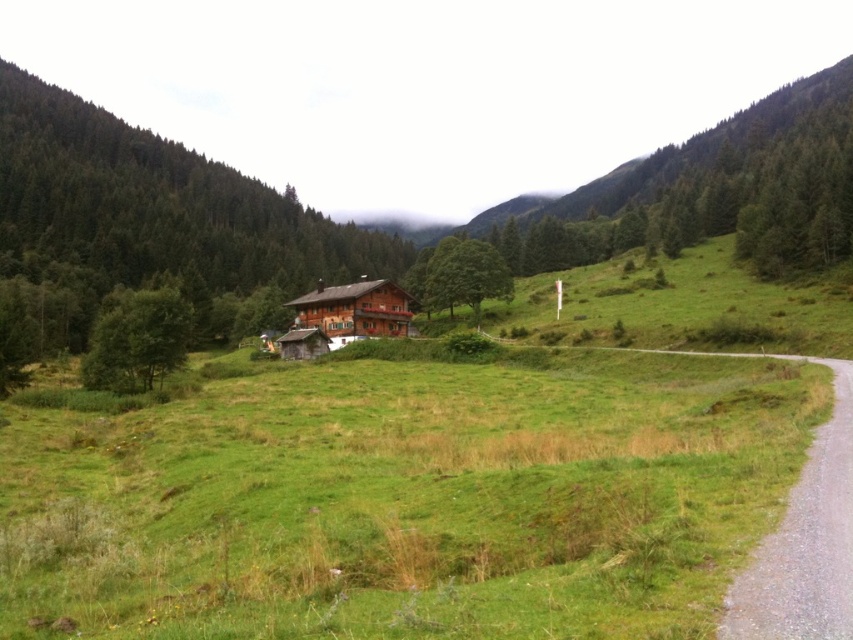
You are standing at the point with coordinates point [137,340] in the image. What object are you facing in the scene?

The point [137,340] corresponds to the green leafy tree at left.

You are standing at the entrance of the wooden house and want to take a walk. Which path should you choose if you want to go towards the gravel road at right without passing by the green leafy tree at left?

You should choose the gravel road at right because it is closer to the viewer than the green leafy tree at left, so you can go directly towards it without needing to pass by the tree.

You are standing at the entrance of the wooden house and want to walk to both the point at coordinates point (621, 516) and point (161, 369). Which point is closer to you?

The point at coordinates point (621, 516) is closer to you than the point at coordinates point (161, 369) because it is closer to the viewer.